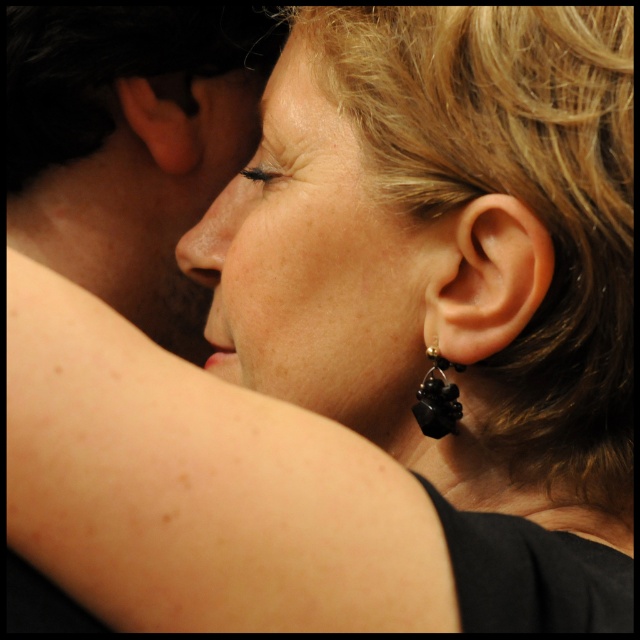
Looking at the scene, which object is bigger between the smooth skin face at center and the matte skin nose at center?

The smooth skin face at center is larger in size than the matte skin nose at center.

You are a photographer adjusting the focus of your camera. You notice two points in the scene labeled as point (170, 106) and point (244, 214). Which point should you focus on to ensure the closest object is sharp?

Point (170, 106) is further to the camera than point (244, 214), so you should focus on point (170, 106) to ensure the closest object is sharp.

From the picture: Based on the scene description, which object is closer to the viewer between the smooth skin face at center and the matte skin nose at center?

The smooth skin face at center is closer to the viewer than the matte skin nose at center.